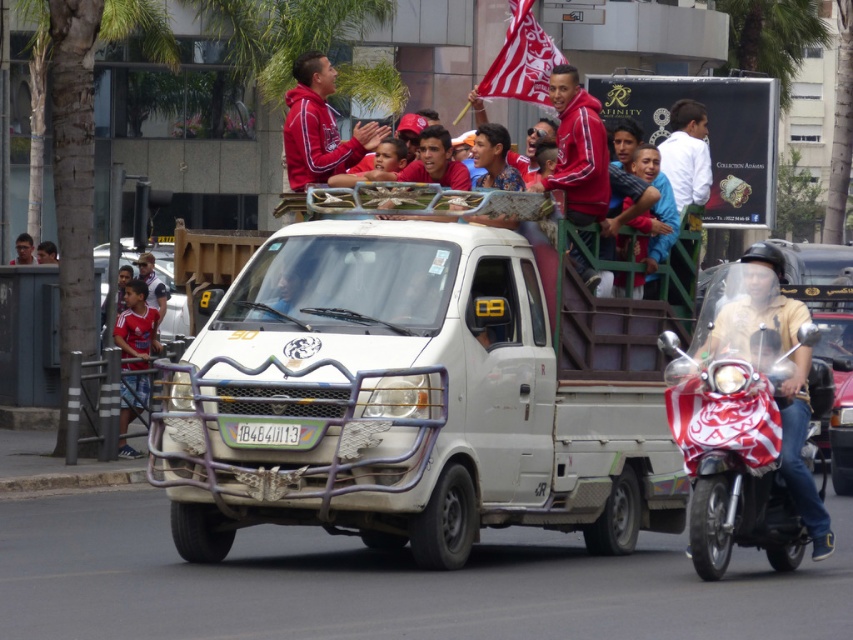
Question: Can you confirm if red fleece jacket at upper center is positioned above red jersey at left?

Choices:
 (A) yes
 (B) no

Answer: (A)

Question: Which object is farther from the camera taking this photo?

Choices:
 (A) white matte truck at center
 (B) red and white fabric covered scooter at right
 (C) red/white fabric flag at upper center

Answer: (C)

Question: Which point is farther to the camera?

Choices:
 (A) (259, 428)
 (B) (566, 112)
 (C) (732, 413)

Answer: (B)

Question: Does red/white fabric flag at upper center appear on the left side of red jersey at left?

Choices:
 (A) no
 (B) yes

Answer: (A)

Question: Among these objects, which one is nearest to the camera?

Choices:
 (A) red and white fabric covered scooter at right
 (B) white matte truck at center

Answer: (B)

Question: Does red and white fabric covered scooter at right have a larger size compared to red/white fabric flag at upper center?

Choices:
 (A) no
 (B) yes

Answer: (B)